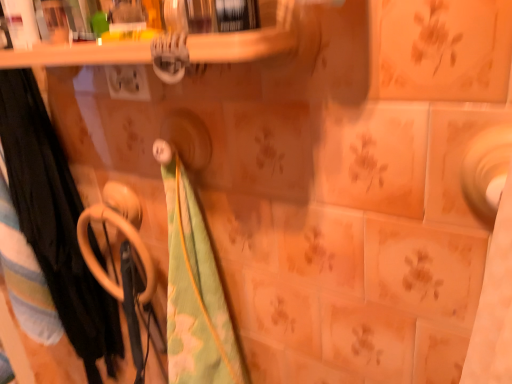
This screenshot has height=384, width=512. What do you see at coordinates (454, 157) in the screenshot?
I see `matte ceramic tile at right` at bounding box center [454, 157].

In order to face black fabric towel at left, which is the 3th beach towel from right to left, should I rotate leftwards or rightwards?

To align with it, rotate left about 32.017°.

Identify the location of green cotton beach towel at left, which is the 2th beach towel in right-to-left order. The image size is (512, 384). tap(57, 223).

Image resolution: width=512 pixels, height=384 pixels. Describe the element at coordinates (57, 223) in the screenshot. I see `green cotton beach towel at left, which is counted as the second beach towel, starting from the left` at that location.

The height and width of the screenshot is (384, 512). Identify the location of matte ceramic tile at right. (454, 157).

This screenshot has height=384, width=512. I want to click on the 3rd beach towel behind the matte ceramic tile at right, starting your count from the anchor, so click(x=24, y=273).

Considering the relative sizes of matte ceramic tile at right and black fabric towel at left, the first beach towel from the left, in the image provided, is matte ceramic tile at right taller than black fabric towel at left, the first beach towel from the left,?

No, matte ceramic tile at right is not taller than black fabric towel at left, the first beach towel from the left.

Between matte ceramic tile at right and black fabric towel at left, which is the 3th beach towel from right to left, which one is positioned in front?

Positioned in front is matte ceramic tile at right.

Which object is thinner, green cotton beach towel at left, which is the 2th beach towel in right-to-left order, or green floral fabric at center, which is the 1th beach towel from right to left?

Thinner between the two is green cotton beach towel at left, which is the 2th beach towel in right-to-left order.

Considering the sizes of green cotton beach towel at left, which is the 2th beach towel in right-to-left order, and green floral fabric at center, arranged as the third beach towel when viewed from the left, in the image, is green cotton beach towel at left, which is the 2th beach towel in right-to-left order, bigger or smaller than green floral fabric at center, arranged as the third beach towel when viewed from the left,?

In the image, green cotton beach towel at left, which is the 2th beach towel in right-to-left order, appears to be larger than green floral fabric at center, arranged as the third beach towel when viewed from the left.

Which is behind, point (45, 239) or point (170, 222)?

Point (45, 239)

From their relative heights in the image, would you say beige plastic towel rack at lower left is taller or shorter than matte ceramic tile at right?

beige plastic towel rack at lower left is taller than matte ceramic tile at right.

Is beige plastic towel rack at lower left positioned before matte ceramic tile at right?

No, the depth of beige plastic towel rack at lower left is greater than that of matte ceramic tile at right.

Is matte ceramic tile at right surrounded by beige plastic towel rack at lower left?

No, matte ceramic tile at right is not surrounded by beige plastic towel rack at lower left.

Who is smaller, beige plastic towel rack at lower left or matte ceramic tile at right?

matte ceramic tile at right.

There is a matte ceramic tile at right. Where is `the 3rd beach towel below it (from the image's perspective)`? the 3rd beach towel below it (from the image's perspective) is located at coordinates (195, 294).

Is green floral fabric at center, arranged as the third beach towel when viewed from the left, at the right side of matte ceramic tile at right?

No, green floral fabric at center, arranged as the third beach towel when viewed from the left, is not to the right of matte ceramic tile at right.

Which object is closer to the camera taking this photo, green floral fabric at center, arranged as the third beach towel when viewed from the left, or matte ceramic tile at right?

matte ceramic tile at right.

Considering the sizes of green floral fabric at center, arranged as the third beach towel when viewed from the left, and green cotton beach towel at left, which is counted as the second beach towel, starting from the left, in the image, is green floral fabric at center, arranged as the third beach towel when viewed from the left, wider or thinner than green cotton beach towel at left, which is counted as the second beach towel, starting from the left,?

Considering their sizes, green floral fabric at center, arranged as the third beach towel when viewed from the left, looks broader than green cotton beach towel at left, which is counted as the second beach towel, starting from the left.

Is green floral fabric at center, which is the 1th beach towel from right to left, positioned far away from green cotton beach towel at left, which is the 2th beach towel in right-to-left order?

Actually, green floral fabric at center, which is the 1th beach towel from right to left, and green cotton beach towel at left, which is the 2th beach towel in right-to-left order, are a little close together.

Considering the sizes of objects green floral fabric at center, which is the 1th beach towel from right to left, and green cotton beach towel at left, which is the 2th beach towel in right-to-left order, in the image provided, who is smaller, green floral fabric at center, which is the 1th beach towel from right to left, or green cotton beach towel at left, which is the 2th beach towel in right-to-left order,?

Smaller between the two is green floral fabric at center, which is the 1th beach towel from right to left.

Could you measure the distance between green floral fabric at center, arranged as the third beach towel when viewed from the left, and green cotton beach towel at left, which is the 2th beach towel in right-to-left order?

green floral fabric at center, arranged as the third beach towel when viewed from the left, and green cotton beach towel at left, which is the 2th beach towel in right-to-left order, are 36.56 centimeters apart.

Is beige plastic towel rack at lower left far from black fabric towel at left, which is the 3th beach towel from right to left?

No, beige plastic towel rack at lower left is not far from black fabric towel at left, which is the 3th beach towel from right to left.

Is beige plastic towel rack at lower left oriented away from black fabric towel at left, the first beach towel from the left?

No, beige plastic towel rack at lower left's orientation is not away from black fabric towel at left, the first beach towel from the left.

How far apart are beige plastic towel rack at lower left and black fabric towel at left, the first beach towel from the left?

beige plastic towel rack at lower left and black fabric towel at left, the first beach towel from the left, are 10.78 inches apart from each other.

From a real-world perspective, is beige plastic towel rack at lower left positioned above or below black fabric towel at left, which is the 3th beach towel from right to left?

beige plastic towel rack at lower left is situated higher than black fabric towel at left, which is the 3th beach towel from right to left, in the real world.

Considering the relative positions of black fabric towel at left, which is the 3th beach towel from right to left, and matte ceramic tile at right in the image provided, is black fabric towel at left, which is the 3th beach towel from right to left, behind matte ceramic tile at right?

That is True.

Are black fabric towel at left, which is the 3th beach towel from right to left, and matte ceramic tile at right located far from each other?

No, there isn't a large distance between black fabric towel at left, which is the 3th beach towel from right to left, and matte ceramic tile at right.

From the image's perspective, between black fabric towel at left, the first beach towel from the left, and matte ceramic tile at right, which one is located above?

matte ceramic tile at right appears higher in the image.

Is black fabric towel at left, which is the 3th beach towel from right to left, shorter than matte ceramic tile at right?

In fact, black fabric towel at left, which is the 3th beach towel from right to left, may be taller than matte ceramic tile at right.

This screenshot has height=384, width=512. I want to click on ceramic tile on the right of black fabric towel at left, which is the 3th beach towel from right to left, so click(x=454, y=157).

This screenshot has height=384, width=512. What are the coordinates of `the 1st beach towel behind the green floral fabric at center, arranged as the third beach towel when viewed from the left` in the screenshot? It's located at (57, 223).

Looking at the image, which one is located closer to matte ceramic tile at right, green floral fabric at center, arranged as the third beach towel when viewed from the left, or beige plastic towel rack at lower left?

green floral fabric at center, arranged as the third beach towel when viewed from the left, is closer to matte ceramic tile at right.

When comparing their distances from green cotton beach towel at left, which is the 2th beach towel in right-to-left order, does matte ceramic tile at right or beige plastic towel rack at lower left seem closer?

beige plastic towel rack at lower left.

When comparing their distances from beige plastic towel rack at lower left, does black fabric towel at left, the first beach towel from the left, or green cotton beach towel at left, which is counted as the second beach towel, starting from the left, seem further?

Among the two, black fabric towel at left, the first beach towel from the left, is located further to beige plastic towel rack at lower left.

Which object lies further to the anchor point green floral fabric at center, arranged as the third beach towel when viewed from the left, matte ceramic tile at right or black fabric towel at left, the first beach towel from the left?

black fabric towel at left, the first beach towel from the left, is positioned further to the anchor green floral fabric at center, arranged as the third beach towel when viewed from the left.

Looking at the image, which one is located further to green cotton beach towel at left, which is counted as the second beach towel, starting from the left, black fabric towel at left, which is the 3th beach towel from right to left, or beige plastic towel rack at lower left?

Based on the image, beige plastic towel rack at lower left appears to be further to green cotton beach towel at left, which is counted as the second beach towel, starting from the left.

Looking at the image, which one is located further to black fabric towel at left, which is the 3th beach towel from right to left, matte ceramic tile at right or green floral fabric at center, which is the 1th beach towel from right to left?

Based on the image, matte ceramic tile at right appears to be further to black fabric towel at left, which is the 3th beach towel from right to left.

Based on their spatial positions, is beige plastic towel rack at lower left or matte ceramic tile at right further from green cotton beach towel at left, which is counted as the second beach towel, starting from the left?

matte ceramic tile at right.

When comparing their distances from beige plastic towel rack at lower left, does green floral fabric at center, arranged as the third beach towel when viewed from the left, or matte ceramic tile at right seem further?

matte ceramic tile at right is positioned further to the anchor beige plastic towel rack at lower left.

Locate an element on the screen. beach towel situated between beige plastic towel rack at lower left and matte ceramic tile at right from left to right is located at coordinates (195, 294).

Locate an element on the screen. The height and width of the screenshot is (384, 512). beach towel between black fabric towel at left, the first beach towel from the left, and beige plastic towel rack at lower left is located at coordinates pos(57,223).

Locate an element on the screen. The image size is (512, 384). towel rack located between black fabric towel at left, the first beach towel from the left, and green floral fabric at center, arranged as the third beach towel when viewed from the left, in the left-right direction is located at coordinates (129, 241).

This screenshot has height=384, width=512. Identify the location of beach towel situated between black fabric towel at left, the first beach towel from the left, and green floral fabric at center, which is the 1th beach towel from right to left, from left to right. tap(57, 223).